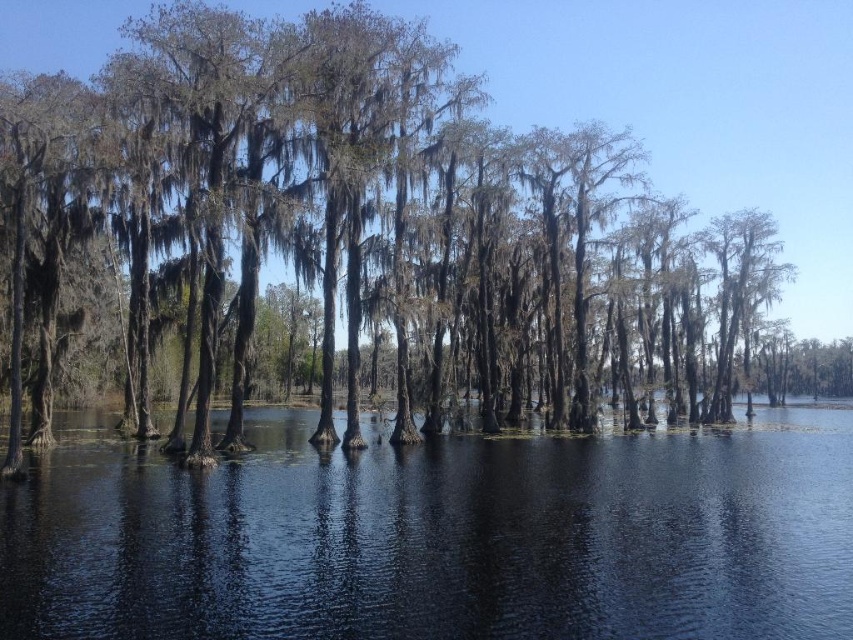
You are standing on a wooden boardwalk observing the swamp. You notice the transparent water at center and the smooth bark trees at center. Which object is positioned lower in the scene?

The transparent water at center is positioned below the smooth bark trees at center, so it is lower in the scene.

You are a nature photographer planning to capture the swamp landscape. You have a camera with a 100mm lens that can focus on objects up to 300 feet away. You see the transparent water at center and the smooth bark trees at center in your viewfinder. Can you focus on both subjects simultaneously with your current lens setting?

The transparent water at center and smooth bark trees at center are 296.18 feet apart. Since your camera lens can focus up to 300 feet, you can focus on both subjects simultaneously as the distance between them is within the lens range.

You are a photographer planning to capture the reflection of the smooth bark trees at center in the transparent water at center. Based on their spatial relationship, can you confirm if the reflection will be fully visible in the water?

The transparent water at center is thinner than smooth bark trees at center, so the reflection of the smooth bark trees at center may not be fully visible in the water due to the water being thinner.